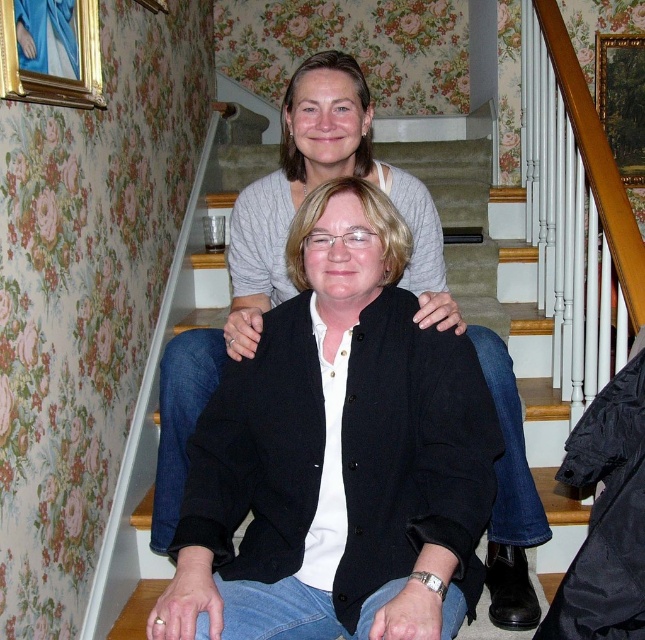
Looking at this image, you are standing at the bottom of the wooden staircase at center and want to reach the wooden picture frame at upper right. How many steps do you need to climb to get there?

The wooden staircase at center is 7.09 feet away from the wooden picture frame at upper right. Assuming each step is about 0.7 feet high, you would need to climb approximately 10 steps to reach the wooden picture frame at upper right.

You are standing at the bottom of the wooden staircase at center and want to reach the top. The camera is positioned at the bottom. How many steps do you need to climb to reach the top?

The wooden staircase at center is 6.04 feet from camera. Since the camera is at the bottom, you need to climb all the steps to reach the top.